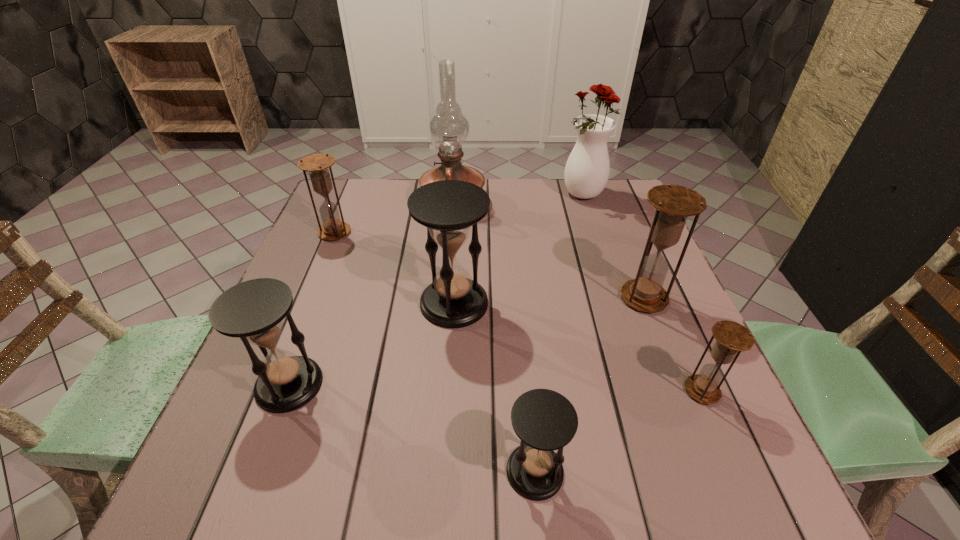
I want to click on free spot located 0.270m on the left of the nearest black hourglass, so click(340, 471).

Identify the location of oil lamp present at the far edge. The height and width of the screenshot is (540, 960). (449, 128).

In order to click on vase at the far edge in this screenshot , I will do `click(587, 170)`.

Find the location of `hourglass present at the far edge`. hourglass present at the far edge is located at coordinates (317, 165).

Locate an element on the screen. The width and height of the screenshot is (960, 540). object that is positioned at the near edge is located at coordinates (544, 420).

This screenshot has height=540, width=960. What are the coordinates of `vase located in the right edge section of the desktop` in the screenshot? It's located at (587, 170).

Where is `object situated at the far left corner`? object situated at the far left corner is located at coordinates (317, 165).

Locate an element on the screen. The image size is (960, 540). object located in the far right corner section of the desktop is located at coordinates (587, 170).

Where is `free location at the near edge of the desktop`? free location at the near edge of the desktop is located at coordinates (652, 467).

Locate an element on the screen. The height and width of the screenshot is (540, 960). vacant position at the left edge of the desktop is located at coordinates (322, 320).